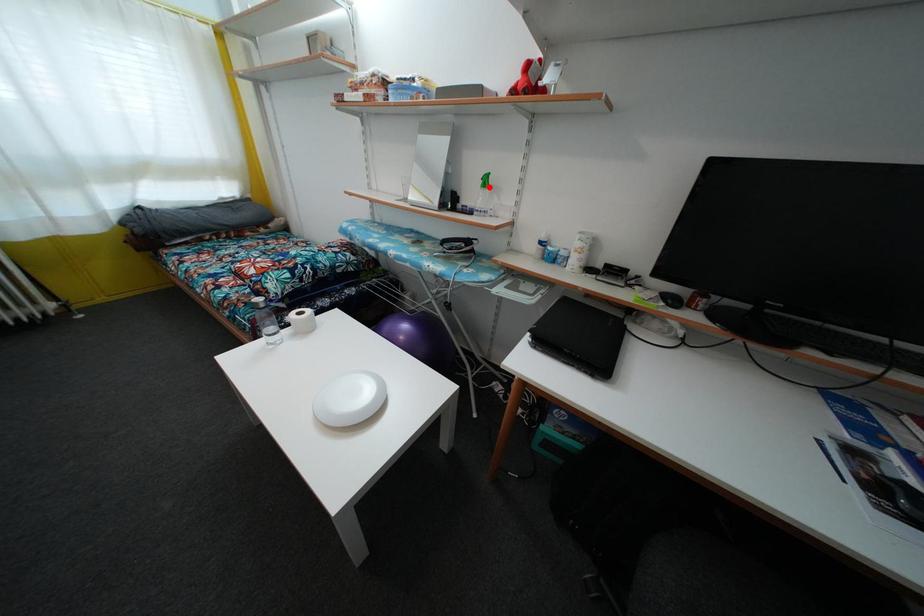
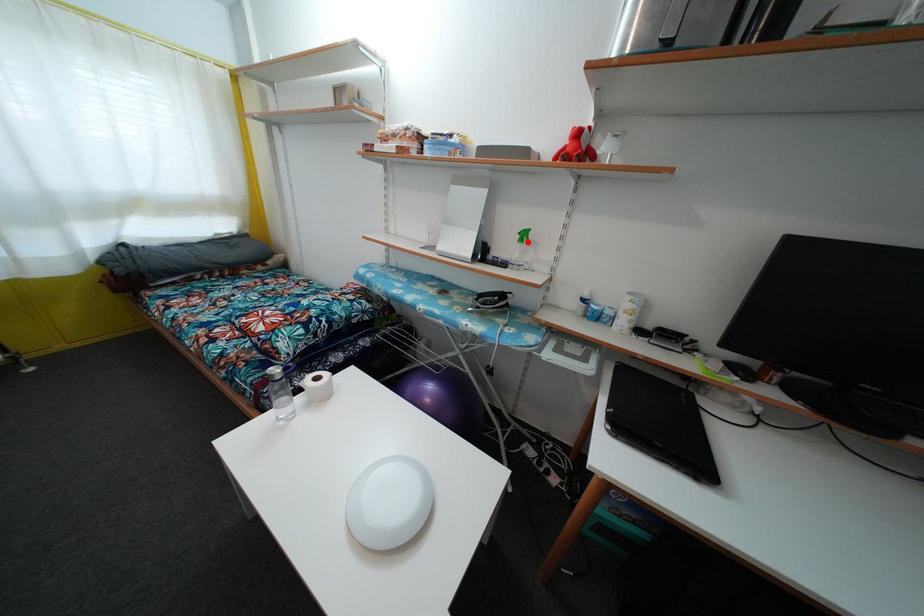
I am providing you with two images of the same scene from different viewpoints. A red point is marked on the first image and another point is marked on the second image. Does the point marked in image1 correspond to the same location as the one in image2?

Yes